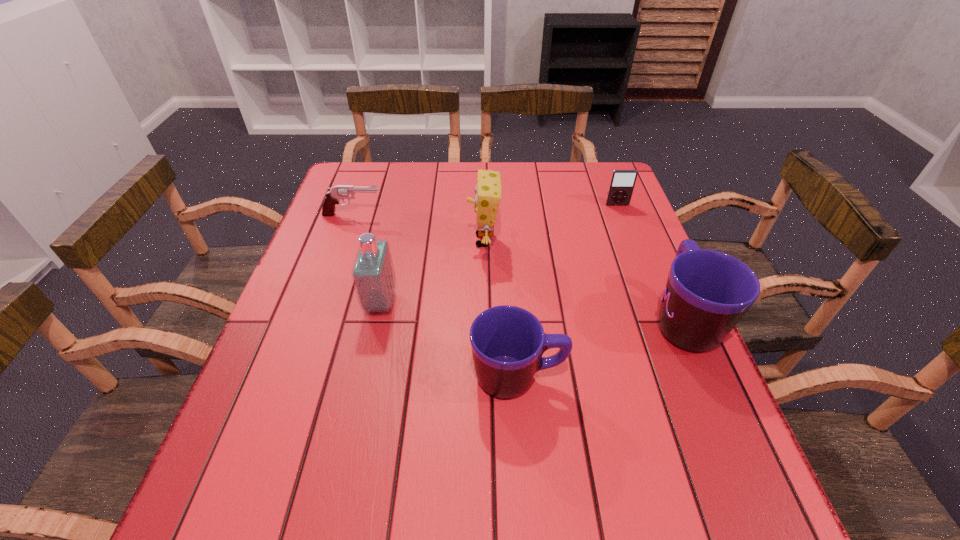
Identify the location of iPod that is at the right edge. (622, 182).

This screenshot has height=540, width=960. What are the coordinates of `object at the far right corner` in the screenshot? It's located at (622, 182).

In the image, there is a desktop. Where is `vacant space at the far edge`? The height and width of the screenshot is (540, 960). vacant space at the far edge is located at coordinates (435, 166).

You are a GUI agent. You are given a task and a screenshot of the screen. Output one action in this format:
    pyautogui.click(x=<x>, y=<y>)
    Task: Click on the vacant area at the near edge of the desktop
    
    Given the screenshot: What is the action you would take?
    pyautogui.click(x=610, y=452)

At what (x,y) coordinates should I click in order to perform the action: click on free space at the left edge of the desktop. Please return your answer as a coordinate pair (x, y). Looking at the image, I should click on (303, 375).

The width and height of the screenshot is (960, 540). In the image, there is a desktop. In order to click on vacant space at the right edge in this screenshot , I will do `click(668, 370)`.

The image size is (960, 540). I want to click on free spot at the far left corner of the desktop, so click(x=338, y=181).

Locate an element on the screen. This screenshot has height=540, width=960. vacant space at the far right corner of the desktop is located at coordinates (603, 164).

Identify the location of free spot between the sponge and the gun. (419, 228).

Find the location of `vacant region between the shorter mug and the gun`. vacant region between the shorter mug and the gun is located at coordinates (435, 296).